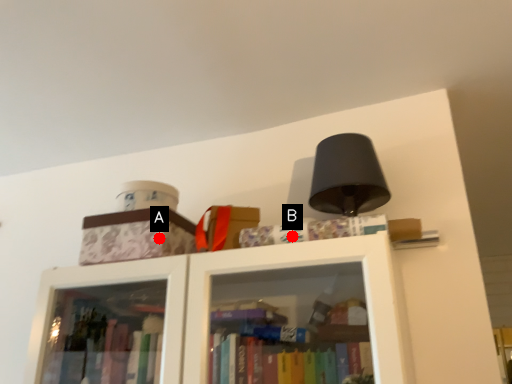
Question: Two points are circled on the image, labeled by A and B beside each circle. Which point is closer to the camera?

Choices:
 (A) A is closer
 (B) B is closer

Answer: (B)